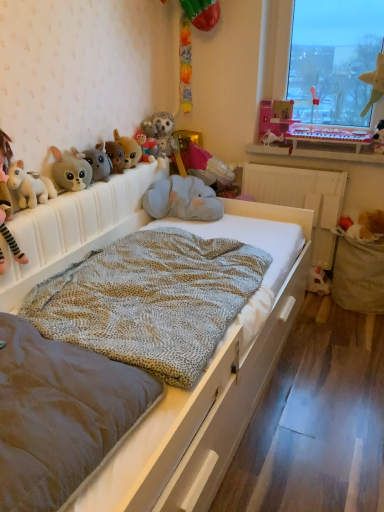
Question: From a real-world perspective, does brown plush toy at right, the 2th toy viewed from the right, stand above fuzzy brown plush dog at upper center, positioned as the 4th toy in left-to-right order?

Choices:
 (A) no
 (B) yes

Answer: (A)

Question: Is brown plush toy at right, which appears as the twelfth toy when viewed from the left, not close to fuzzy brown plush dog at upper center, positioned as the 4th toy in left-to-right order?

Choices:
 (A) no
 (B) yes

Answer: (B)

Question: Is brown plush toy at right, which appears as the twelfth toy when viewed from the left, smaller than fuzzy brown plush dog at upper center, arranged as the 10th toy when viewed from the right?

Choices:
 (A) no
 (B) yes

Answer: (A)

Question: Is fuzzy brown plush dog at upper center, positioned as the 4th toy in left-to-right order, at the back of brown plush toy at right, which appears as the twelfth toy when viewed from the left?

Choices:
 (A) no
 (B) yes

Answer: (A)

Question: Could you tell me if brown plush toy at right, the 2th toy viewed from the right, is turned towards fuzzy brown plush dog at upper center, arranged as the 10th toy when viewed from the right?

Choices:
 (A) yes
 (B) no

Answer: (B)

Question: Is brown plush toy at right, the 2th toy viewed from the right, taller than fuzzy brown plush dog at upper center, arranged as the 10th toy when viewed from the right?

Choices:
 (A) no
 (B) yes

Answer: (A)

Question: Is green felt star at upper right, which ranks as the 3th toy in right-to-left order, looking in the opposite direction of velvet grey mattress at center?

Choices:
 (A) yes
 (B) no

Answer: (B)

Question: Does green felt star at upper right, positioned as the eleventh toy in left-to-right order, appear on the right side of velvet grey mattress at center?

Choices:
 (A) yes
 (B) no

Answer: (A)

Question: Considering the relative positions of green felt star at upper right, positioned as the eleventh toy in left-to-right order, and velvet grey mattress at center in the image provided, is green felt star at upper right, positioned as the eleventh toy in left-to-right order, in front of velvet grey mattress at center?

Choices:
 (A) yes
 (B) no

Answer: (B)

Question: Considering the relative positions of green felt star at upper right, which ranks as the 3th toy in right-to-left order, and velvet grey mattress at center in the image provided, is green felt star at upper right, which ranks as the 3th toy in right-to-left order, to the left of velvet grey mattress at center from the viewer's perspective?

Choices:
 (A) yes
 (B) no

Answer: (B)

Question: Considering the relative sizes of green felt star at upper right, which ranks as the 3th toy in right-to-left order, and velvet grey mattress at center in the image provided, is green felt star at upper right, which ranks as the 3th toy in right-to-left order, taller than velvet grey mattress at center?

Choices:
 (A) no
 (B) yes

Answer: (B)

Question: Does green felt star at upper right, positioned as the eleventh toy in left-to-right order, lie behind velvet grey mattress at center?

Choices:
 (A) yes
 (B) no

Answer: (A)

Question: From the image's perspective, is matte plush rabbit at left, arranged as the 2th toy when viewed from the left, on brown plush toy at right, which appears as the twelfth toy when viewed from the left?

Choices:
 (A) yes
 (B) no

Answer: (A)